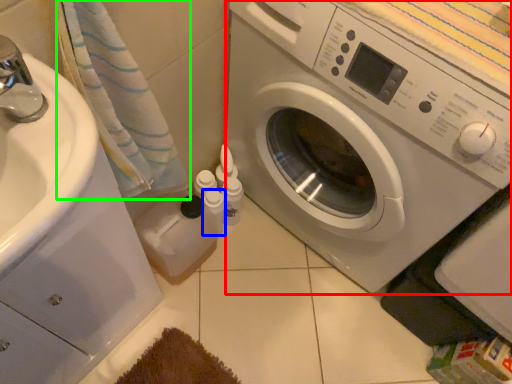
Question: Considering the real-world distances, which object is farthest from washing machine (highlighted by a red box)? toiletry (highlighted by a blue box) or bath towel (highlighted by a green box)?

Choices:
 (A) toiletry
 (B) bath towel

Answer: (A)